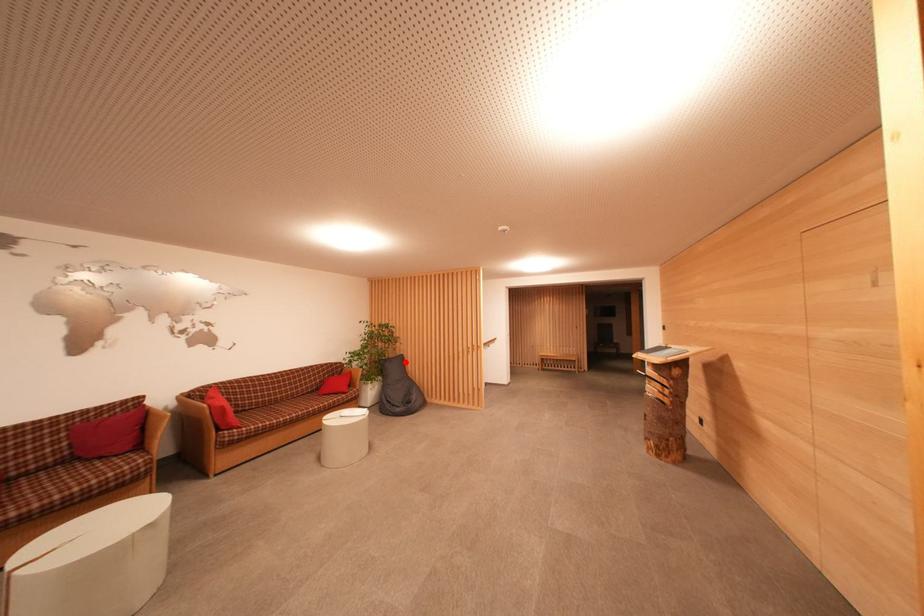
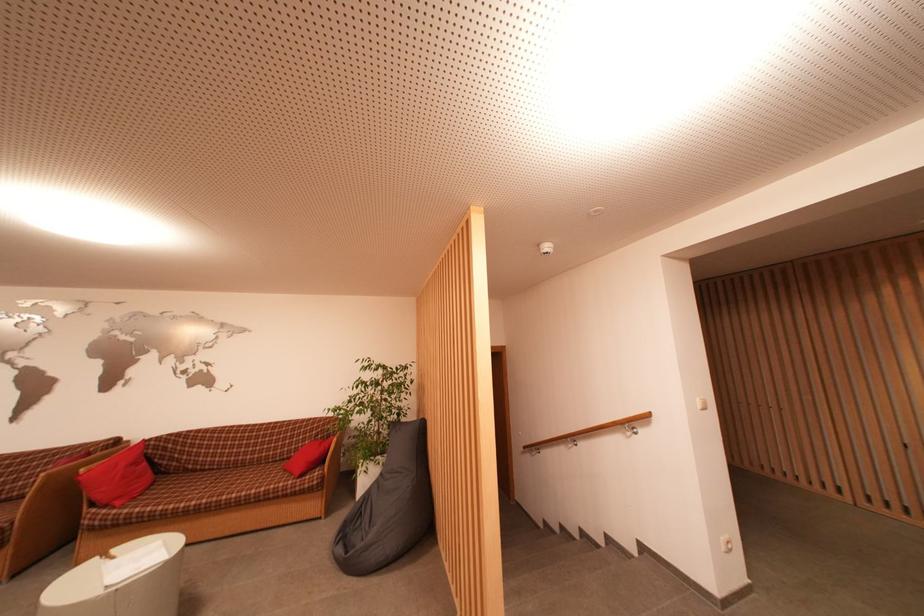
Question: I am providing you with two images of the same scene from different viewpoints. A red point is marked on the first image. Is the red point's position out of view in image 2?

Choices:
 (A) Yes
 (B) No

Answer: (B)